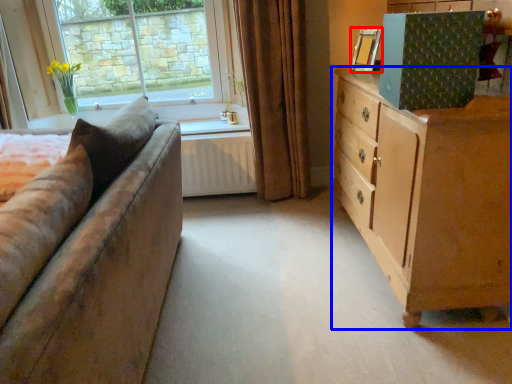
Question: Which point is further to the camera, picture frame (highlighted by a red box) or chest of drawers (highlighted by a blue box)?

Choices:
 (A) picture frame
 (B) chest of drawers

Answer: (A)